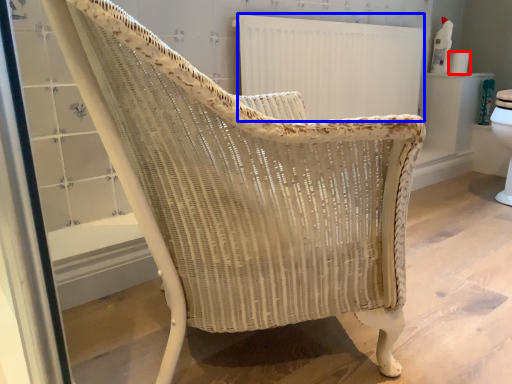
Question: Which of the following is the farthest to the observer, toilet paper (highlighted by a red box) or radiator (highlighted by a blue box)?

Choices:
 (A) toilet paper
 (B) radiator

Answer: (A)